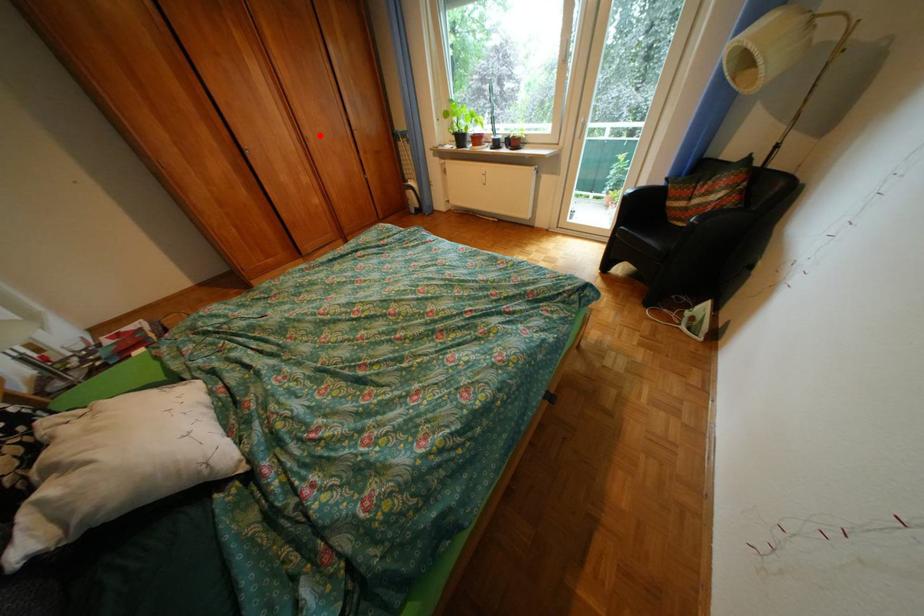
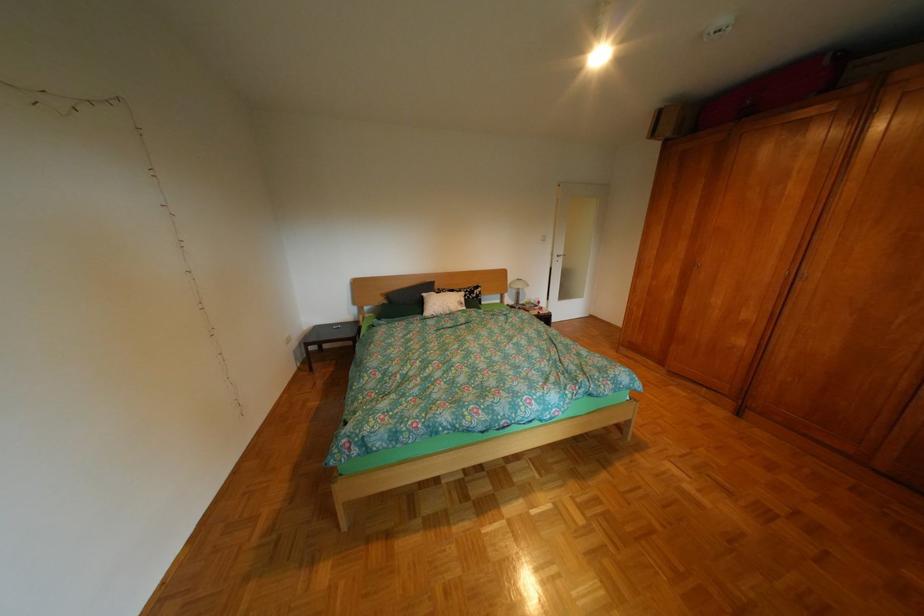
The point at the highlighted location is marked in the first image. Where is the corresponding point in the second image?

(819, 273)